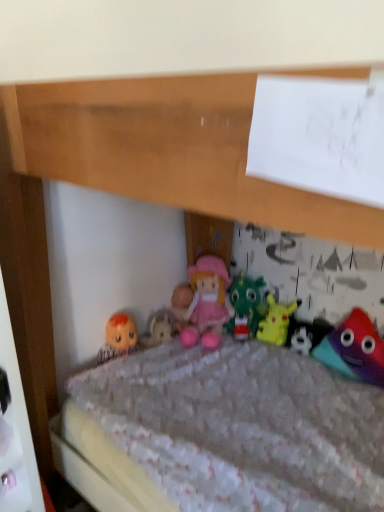
Locate an element on the screen. pink fabric doll at center, positioned as the 1th toy in left-to-right order is located at coordinates (245, 306).

Measure the distance between point (360, 317) and camera.

5.33 feet.

Where is `pink fabric doll at center`? The height and width of the screenshot is (512, 384). pink fabric doll at center is located at coordinates (207, 303).

Identify the location of white plush toy at center, the 3th toy when ordered from left to right. Image resolution: width=384 pixels, height=512 pixels. (306, 334).

From a real-world perspective, is yellow plush toy at center, the 2th toy positioned from the left, under multicolored plush toy at lower right, arranged as the fourth toy when viewed from the left?

Yes, from a real-world perspective, yellow plush toy at center, the 2th toy positioned from the left, is under multicolored plush toy at lower right, arranged as the fourth toy when viewed from the left.

Which object is positioned more to the right, yellow plush toy at center, the 2th toy positioned from the left, or multicolored plush toy at lower right, the first toy viewed from the right?

multicolored plush toy at lower right, the first toy viewed from the right.

Considering the positions of objects yellow plush toy at center, the 2th toy positioned from the left, and multicolored plush toy at lower right, the first toy viewed from the right, in the image provided, who is in front, yellow plush toy at center, the 2th toy positioned from the left, or multicolored plush toy at lower right, the first toy viewed from the right,?

multicolored plush toy at lower right, the first toy viewed from the right, is in front.

Is yellow plush toy at center, the 2th toy positioned from the left, far away from multicolored plush toy at lower right, the first toy viewed from the right?

That's not correct — yellow plush toy at center, the 2th toy positioned from the left, is a little close to multicolored plush toy at lower right, the first toy viewed from the right.

Between yellow plush toy at center, the third toy when ordered from right to left, and pink fabric doll at center, which one has smaller width?

Thinner between the two is yellow plush toy at center, the third toy when ordered from right to left.

Is yellow plush toy at center, the third toy when ordered from right to left, further to the viewer compared to pink fabric doll at center?

Yes, it is.

Is yellow plush toy at center, the third toy when ordered from right to left, facing away from pink fabric doll at center?

No, yellow plush toy at center, the third toy when ordered from right to left, is not facing away from pink fabric doll at center.

Can you tell me how much yellow plush toy at center, the 2th toy positioned from the left, and pink fabric doll at center differ in facing direction?

35.1 degrees.

Can you tell me how much multicolored plush toy at lower right, arranged as the fourth toy when viewed from the left, and pink fabric doll at center, positioned as the 1th toy in left-to-right order, differ in facing direction?

→ The angular difference between multicolored plush toy at lower right, arranged as the fourth toy when viewed from the left, and pink fabric doll at center, positioned as the 1th toy in left-to-right order, is 1.22 degrees.

Is multicolored plush toy at lower right, arranged as the fourth toy when viewed from the left, inside the boundaries of pink fabric doll at center, positioned as the 1th toy in left-to-right order, or outside?

multicolored plush toy at lower right, arranged as the fourth toy when viewed from the left, cannot be found inside pink fabric doll at center, positioned as the 1th toy in left-to-right order.

Is pink fabric doll at center, placed as the fourth toy when sorted from right to left, at the back of multicolored plush toy at lower right, arranged as the fourth toy when viewed from the left?

No, multicolored plush toy at lower right, arranged as the fourth toy when viewed from the left,'s orientation is not away from pink fabric doll at center, placed as the fourth toy when sorted from right to left.

Does multicolored plush toy at lower right, the first toy viewed from the right, have a lesser height compared to pink fabric doll at center, placed as the fourth toy when sorted from right to left?

Incorrect, the height of multicolored plush toy at lower right, the first toy viewed from the right, does not fall short of that of pink fabric doll at center, placed as the fourth toy when sorted from right to left.

How many degrees apart are the facing directions of pink fabric doll at center and pink fabric doll at center, placed as the fourth toy when sorted from right to left?

There is a 33.1-degree angle between the facing directions of pink fabric doll at center and pink fabric doll at center, placed as the fourth toy when sorted from right to left.

In terms of height, does pink fabric doll at center look taller or shorter compared to pink fabric doll at center, placed as the fourth toy when sorted from right to left?

pink fabric doll at center is taller than pink fabric doll at center, placed as the fourth toy when sorted from right to left.

Which object is thinner, pink fabric doll at center or pink fabric doll at center, placed as the fourth toy when sorted from right to left?

Thinner between the two is pink fabric doll at center, placed as the fourth toy when sorted from right to left.

From a real-world perspective, is pink fabric doll at center over pink fabric doll at center, positioned as the 1th toy in left-to-right order?

Correct, in the physical world, pink fabric doll at center is higher than pink fabric doll at center, positioned as the 1th toy in left-to-right order.

Is pink fabric doll at center, positioned as the 1th toy in left-to-right order, facing away from multicolored plush toy at lower right, arranged as the fourth toy when viewed from the left?

pink fabric doll at center, positioned as the 1th toy in left-to-right order, is not turned away from multicolored plush toy at lower right, arranged as the fourth toy when viewed from the left.

Considering the sizes of objects pink fabric doll at center, placed as the fourth toy when sorted from right to left, and multicolored plush toy at lower right, arranged as the fourth toy when viewed from the left, in the image provided, who is wider, pink fabric doll at center, placed as the fourth toy when sorted from right to left, or multicolored plush toy at lower right, arranged as the fourth toy when viewed from the left,?

pink fabric doll at center, placed as the fourth toy when sorted from right to left, is wider.

Looking at this image, from the image's perspective, is pink fabric doll at center, placed as the fourth toy when sorted from right to left, positioned above or below multicolored plush toy at lower right, arranged as the fourth toy when viewed from the left?

Clearly, from the image's perspective, pink fabric doll at center, placed as the fourth toy when sorted from right to left, is above multicolored plush toy at lower right, arranged as the fourth toy when viewed from the left.

From a real-world perspective, who is located higher, pink fabric doll at center, placed as the fourth toy when sorted from right to left, or multicolored plush toy at lower right, the first toy viewed from the right?

In real-world perspective, pink fabric doll at center, placed as the fourth toy when sorted from right to left, is above.

Considering the relative sizes of multicolored plush toy at lower right, arranged as the fourth toy when viewed from the left, and pink fabric doll at center in the image provided, is multicolored plush toy at lower right, arranged as the fourth toy when viewed from the left, thinner than pink fabric doll at center?

Indeed, multicolored plush toy at lower right, arranged as the fourth toy when viewed from the left, has a lesser width compared to pink fabric doll at center.

Does multicolored plush toy at lower right, arranged as the fourth toy when viewed from the left, have a lesser height compared to pink fabric doll at center?

Yes.

Is multicolored plush toy at lower right, arranged as the fourth toy when viewed from the left, located outside pink fabric doll at center?

Yes, multicolored plush toy at lower right, arranged as the fourth toy when viewed from the left, is outside of pink fabric doll at center.

Considering the points (359, 359) and (203, 294), which point is in front, point (359, 359) or point (203, 294)?

Positioned in front is point (359, 359).

Does pink fabric doll at center touch white plush toy at center, the 3th toy when ordered from left to right?

No, pink fabric doll at center is not in contact with white plush toy at center, the 3th toy when ordered from left to right.

How different are the orientations of pink fabric doll at center and white plush toy at center, the 3th toy when ordered from left to right, in degrees?

The angle between the facing direction of pink fabric doll at center and the facing direction of white plush toy at center, the 3th toy when ordered from left to right, is 34.6 degrees.

Could you tell me if pink fabric doll at center is facing white plush toy at center, placed as the 2th toy when sorted from right to left?

No, pink fabric doll at center is not oriented towards white plush toy at center, placed as the 2th toy when sorted from right to left.

There is a yellow plush toy at center, the 2th toy positioned from the left. What are the coordinates of `the 1st toy above it (from a real-world perspective)` in the screenshot? It's located at (354, 349).

Locate an element on the screen. This screenshot has height=512, width=384. toy that is the 2nd one when counting rightward from the pink fabric doll at center is located at coordinates (276, 321).

Considering their positions, is yellow plush toy at center, the 2th toy positioned from the left, positioned further to multicolored plush toy at lower right, the first toy viewed from the right, than white plush toy at center, placed as the 2th toy when sorted from right to left?

yellow plush toy at center, the 2th toy positioned from the left.

Based on the photo, estimate the real-world distances between objects in this image. Which object is closer to multicolored plush toy at lower right, the first toy viewed from the right, pink fabric doll at center, placed as the fourth toy when sorted from right to left, or white plush toy at center, the 3th toy when ordered from left to right?

white plush toy at center, the 3th toy when ordered from left to right, lies closer to multicolored plush toy at lower right, the first toy viewed from the right, than the other object.

Estimate the real-world distances between objects in this image. Which object is closer to yellow plush toy at center, the 2th toy positioned from the left, pink fabric doll at center, placed as the fourth toy when sorted from right to left, or pink fabric doll at center?

Based on the image, pink fabric doll at center, placed as the fourth toy when sorted from right to left, appears to be nearer to yellow plush toy at center, the 2th toy positioned from the left.

When comparing their distances from pink fabric doll at center, does white plush toy at center, the 3th toy when ordered from left to right, or yellow plush toy at center, the 2th toy positioned from the left, seem further?

white plush toy at center, the 3th toy when ordered from left to right, lies further to pink fabric doll at center than the other object.

Estimate the real-world distances between objects in this image. Which object is further from yellow plush toy at center, the 2th toy positioned from the left, multicolored plush toy at lower right, arranged as the fourth toy when viewed from the left, or pink fabric doll at center?

Among the two, multicolored plush toy at lower right, arranged as the fourth toy when viewed from the left, is located further to yellow plush toy at center, the 2th toy positioned from the left.

Based on their spatial positions, is pink fabric doll at center or multicolored plush toy at lower right, arranged as the fourth toy when viewed from the left, closer to pink fabric doll at center, placed as the fourth toy when sorted from right to left?

Based on the image, pink fabric doll at center appears to be nearer to pink fabric doll at center, placed as the fourth toy when sorted from right to left.

Considering their positions, is yellow plush toy at center, the 2th toy positioned from the left, positioned closer to multicolored plush toy at lower right, arranged as the fourth toy when viewed from the left, than pink fabric doll at center?

Among the two, yellow plush toy at center, the 2th toy positioned from the left, is located nearer to multicolored plush toy at lower right, arranged as the fourth toy when viewed from the left.

Based on their spatial positions, is yellow plush toy at center, the 2th toy positioned from the left, or multicolored plush toy at lower right, arranged as the fourth toy when viewed from the left, further from pink fabric doll at center?

The object further to pink fabric doll at center is multicolored plush toy at lower right, arranged as the fourth toy when viewed from the left.

Locate an element on the screen. toy located between pink fabric doll at center, positioned as the 1th toy in left-to-right order, and white plush toy at center, the 3th toy when ordered from left to right, in the left-right direction is located at coordinates (276, 321).

I want to click on toy between pink fabric doll at center and yellow plush toy at center, the 2th toy positioned from the left, in the horizontal direction, so click(245, 306).

In order to click on toy between multicolored plush toy at lower right, arranged as the fourth toy when viewed from the left, and yellow plush toy at center, the 2th toy positioned from the left, from front to back in this screenshot , I will do `click(306, 334)`.